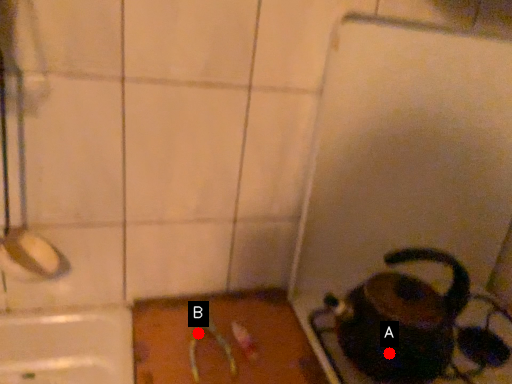
Question: Two points are circled on the image, labeled by A and B beside each circle. Which point appears farthest from the camera in this image?

Choices:
 (A) A is further
 (B) B is further

Answer: (B)